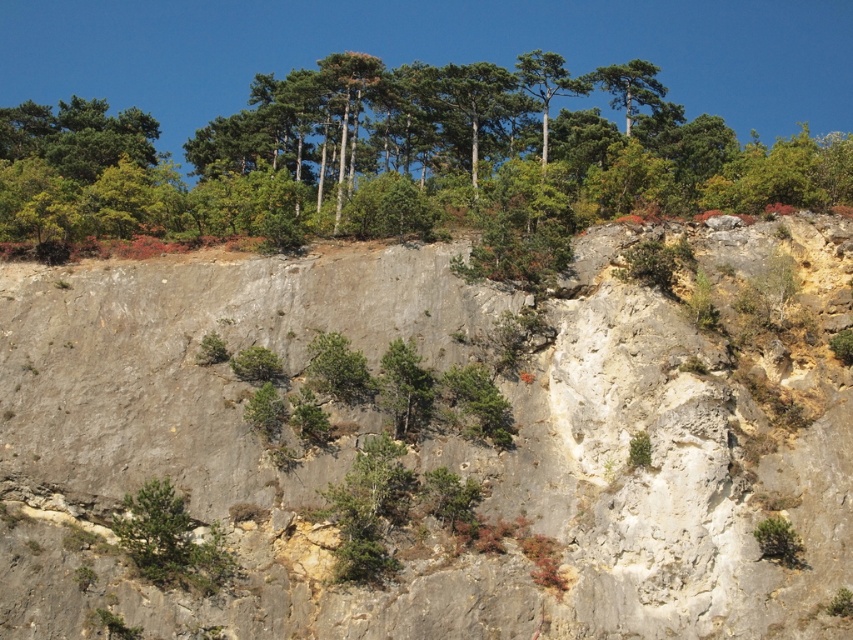
You are a hiker standing at the base of the cliff. You see the gray rock at center and the green leafy shrub at lower left. Which object is closer to you?

The gray rock at center is closer to you because it is in front of the green leafy shrub at lower left.

You are a hiker trying to navigate the rocky cliff. You see the gray rock at center and the green leafy shrub at lower left. Which object would be more stable to step on for support?

The gray rock at center is larger than the green leafy shrub at lower left, so stepping on the gray rock at center would provide more stability.

You are standing at the base of the cliff and looking upward. There are two points marked on the cliff face. One is at coordinate point [146,184] and the other at point [143,554]. Which of these two points is closer to your line of sight when you look directly ahead?

Point [143,554] is closer to your line of sight because it is in front of point [146,184], which is behind it.